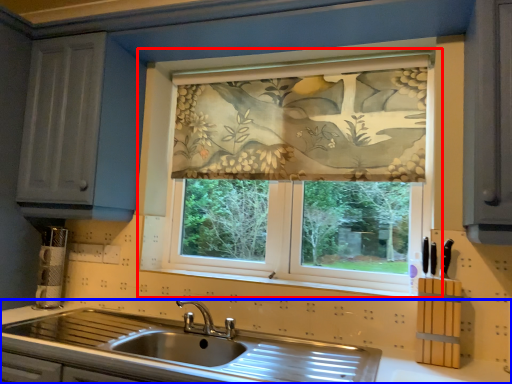
Question: Which object is closer to the camera taking this photo, window (highlighted by a red box) or countertop (highlighted by a blue box)?

Choices:
 (A) window
 (B) countertop

Answer: (B)